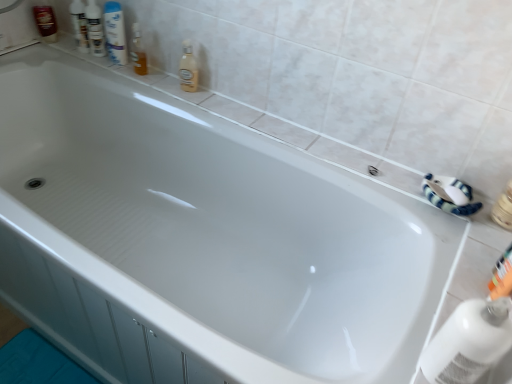
Image resolution: width=512 pixels, height=384 pixels. In order to click on vacant area situated to the left side of white glossy shampoo bottles at upper left, positioned as the second toiletry in back-to-front order in this screenshot , I will do `click(47, 41)`.